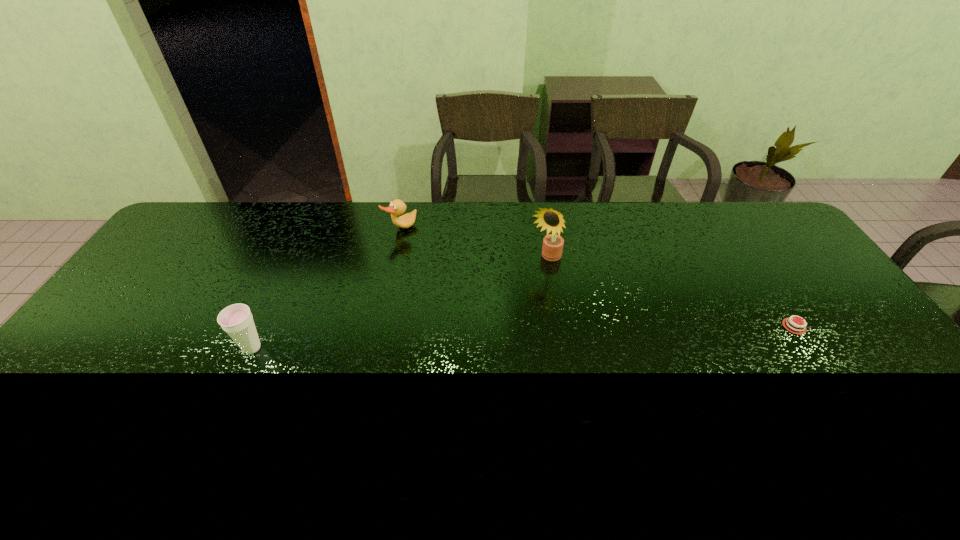
Where is `free space at the right edge`? Image resolution: width=960 pixels, height=540 pixels. free space at the right edge is located at coordinates (830, 292).

In the image, there is a desktop. What are the coordinates of `vacant space at the far left corner` in the screenshot? It's located at (186, 233).

Locate an element on the screen. free spot between the chocolate cake and the cup is located at coordinates (523, 337).

This screenshot has width=960, height=540. Find the location of `vacant space in between the shortest object and the farthest object`. vacant space in between the shortest object and the farthest object is located at coordinates (597, 278).

I want to click on vacant area between the sunflower and the farthest object, so click(x=473, y=244).

Where is `free area in between the chocolate cake and the farthest object`? This screenshot has height=540, width=960. free area in between the chocolate cake and the farthest object is located at coordinates (597, 278).

Locate an element on the screen. The width and height of the screenshot is (960, 540). free space between the third object from left to right and the farthest object is located at coordinates (473, 244).

I want to click on free spot between the duck and the tallest object, so click(473, 244).

Where is `free spot between the tallest object and the cup`? This screenshot has width=960, height=540. free spot between the tallest object and the cup is located at coordinates (398, 303).

Where is `free spot between the sunflower and the rightmost object`? Image resolution: width=960 pixels, height=540 pixels. free spot between the sunflower and the rightmost object is located at coordinates (670, 293).